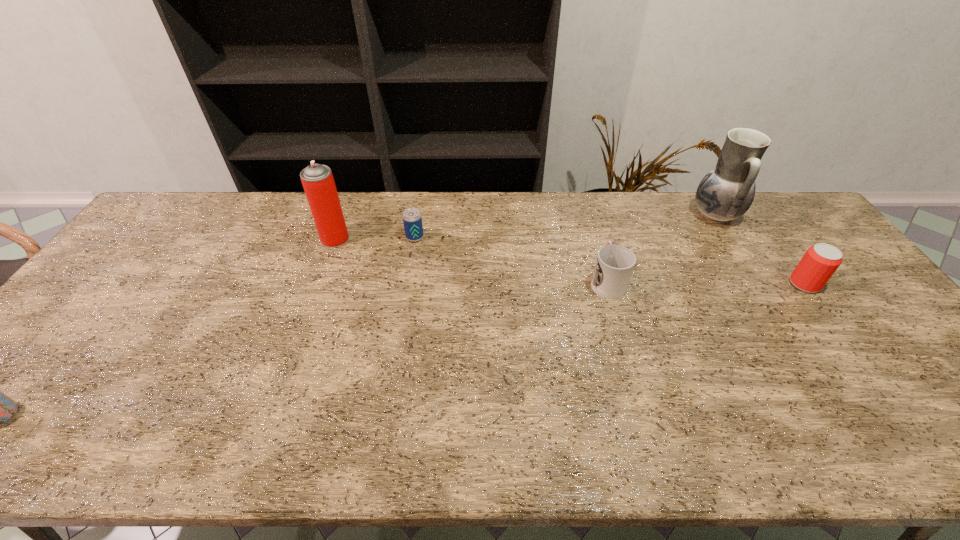
Where is `vacant region located 0.160m on the left of the aerosol can`? vacant region located 0.160m on the left of the aerosol can is located at coordinates (271, 239).

What are the coordinates of `free space located 0.160m on the front of the tallest beer can` in the screenshot? It's located at (846, 341).

The height and width of the screenshot is (540, 960). Identify the location of free space located 0.260m on the side of the cup where the handle is located. (588, 212).

Image resolution: width=960 pixels, height=540 pixels. I want to click on vacant space located 0.080m on the side of the cup where the handle is located, so click(597, 247).

I want to click on free point located on the side of the cup where the handle is located, so click(x=583, y=195).

Identify the location of blank space located on the front of the fourth object from right to left. (397, 344).

You are a GUI agent. You are given a task and a screenshot of the screen. Output one action in this format:
    pyautogui.click(x=<x>, y=<y>)
    Task: Click on the pitcher situated at the far edge
    The image size is (960, 540).
    Given the screenshot: What is the action you would take?
    pyautogui.click(x=726, y=192)

Find the location of a particular element. aerosol can located at the far edge is located at coordinates (318, 182).

At what (x,y) coordinates should I click in order to perform the action: click on beer can at the far edge. Please return your answer as a coordinate pair (x, y). Looking at the image, I should click on (412, 219).

Where is `object present at the right edge`? The height and width of the screenshot is (540, 960). object present at the right edge is located at coordinates (819, 263).